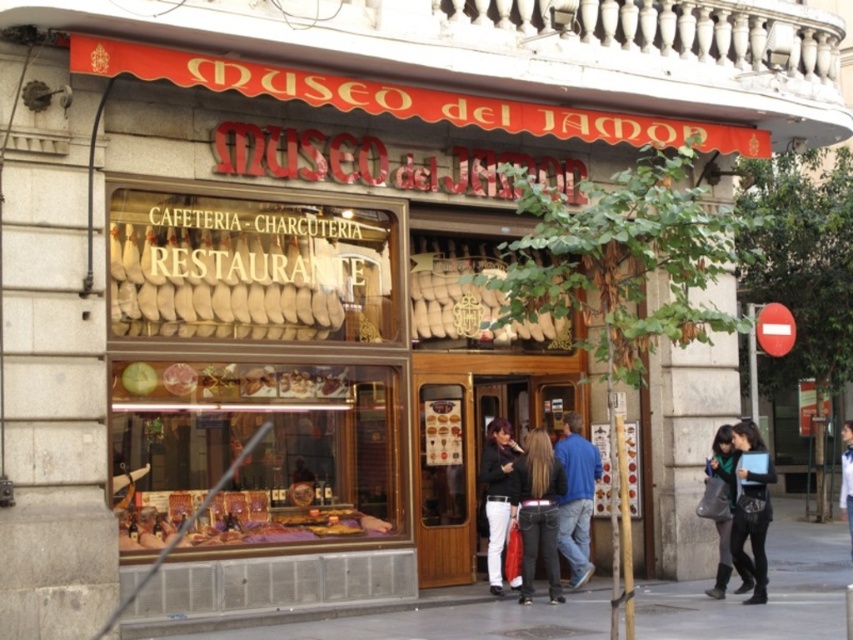
You are a customer entering Museo del Jamon and want to see both the translucent glass display case at lower center and the black leather jacket at lower right. Which object should you look at first to ensure you can see both without moving your position?

You should look at the translucent glass display case at lower center first since it is to the left of the black leather jacket at lower right, allowing you to see both by glancing from left to right without moving.